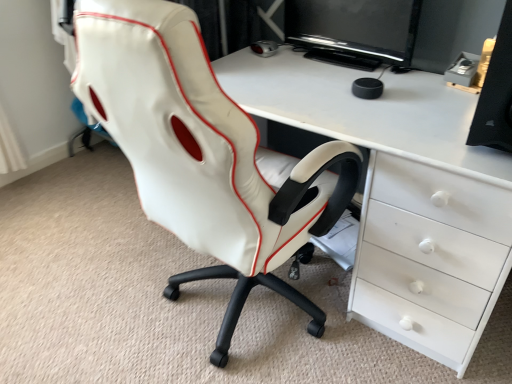
Question: Is black matte speaker at right bigger than white glossy desk at center?

Choices:
 (A) no
 (B) yes

Answer: (A)

Question: From the image's perspective, does black matte speaker at right appear lower than white glossy desk at center?

Choices:
 (A) yes
 (B) no

Answer: (B)

Question: From a real-world perspective, is black matte speaker at right physically below white glossy desk at center?

Choices:
 (A) no
 (B) yes

Answer: (A)

Question: Considering the relative sizes of black matte speaker at right and white glossy desk at center in the image provided, is black matte speaker at right wider than white glossy desk at center?

Choices:
 (A) no
 (B) yes

Answer: (A)

Question: Does black matte speaker at right touch white glossy desk at center?

Choices:
 (A) no
 (B) yes

Answer: (A)

Question: Visually, is black glossy monitor at upper center positioned to the left or to the right of black matte speaker at right?

Choices:
 (A) left
 (B) right

Answer: (A)

Question: Is black glossy monitor at upper center wider or thinner than black matte speaker at right?

Choices:
 (A) wide
 (B) thin

Answer: (B)

Question: Relative to black matte speaker at right, is black glossy monitor at upper center in front or behind?

Choices:
 (A) behind
 (B) front

Answer: (A)

Question: From a real-world perspective, is black glossy monitor at upper center above or below black matte speaker at right?

Choices:
 (A) below
 (B) above

Answer: (A)

Question: Considering the positions of black matte speaker at right and white leather chair at center in the image, is black matte speaker at right wider or thinner than white leather chair at center?

Choices:
 (A) thin
 (B) wide

Answer: (A)

Question: Considering the positions of point (510, 51) and point (322, 185), is point (510, 51) closer or farther from the camera than point (322, 185)?

Choices:
 (A) closer
 (B) farther

Answer: (A)

Question: In terms of height, does black matte speaker at right look taller or shorter compared to white leather chair at center?

Choices:
 (A) short
 (B) tall

Answer: (A)

Question: Is black matte speaker at right bigger or smaller than white leather chair at center?

Choices:
 (A) small
 (B) big

Answer: (A)

Question: Is black glossy monitor at upper center spatially inside white leather chair at center, or outside of it?

Choices:
 (A) inside
 (B) outside

Answer: (B)

Question: Relative to white leather chair at center, is black glossy monitor at upper center in front or behind?

Choices:
 (A) behind
 (B) front

Answer: (A)